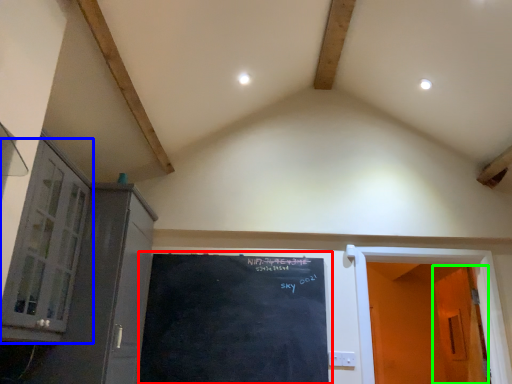
Question: Which object is the farthest from bulletin board (highlighted by a red box)? Choose among these: window (highlighted by a blue box) or door (highlighted by a green box).

Choices:
 (A) window
 (B) door

Answer: (B)